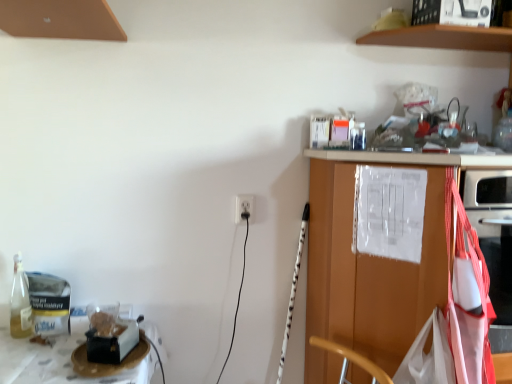
In order to face wooden cabinet at right, should I rotate leftwards or rightwards?

It's best to rotate right around 23.838 degrees.

This screenshot has width=512, height=384. Find the location of `white plastic electric outlet at center`. white plastic electric outlet at center is located at coordinates (245, 208).

This screenshot has height=384, width=512. Find the location of `countertop that is on the left side of brown wooden shelf at upper center`. countertop that is on the left side of brown wooden shelf at upper center is located at coordinates (374, 256).

Considering the positions of objects wooden cabinet at right and brown wooden shelf at upper center in the image provided, who is more to the left, wooden cabinet at right or brown wooden shelf at upper center?

Positioned to the left is wooden cabinet at right.

Based on the photo, is white plastic electric outlet at center turned away from wooden cabinet at right?

No, white plastic electric outlet at center is not facing the opposite direction of wooden cabinet at right.

Is the depth of white plastic electric outlet at center less than that of wooden cabinet at right?

No.

Find the location of a particular element. This screenshot has height=384, width=512. electric outlet that appears on the left of wooden cabinet at right is located at coordinates (245, 208).

Is brown wooden shelf at upper center located outside white plastic electric outlet at center?

Yes.

Could you tell me if brown wooden shelf at upper center is facing white plastic electric outlet at center?

No, brown wooden shelf at upper center is not aimed at white plastic electric outlet at center.

Is brown wooden shelf at upper center taller or shorter than white plastic electric outlet at center?

Clearly, brown wooden shelf at upper center is shorter compared to white plastic electric outlet at center.

Is brown wooden shelf at upper center turned away from wooden cabinet at right?

brown wooden shelf at upper center is not turned away from wooden cabinet at right.

Is brown wooden shelf at upper center directly adjacent to wooden cabinet at right?

No, brown wooden shelf at upper center is not in contact with wooden cabinet at right.

Is brown wooden shelf at upper center surrounding wooden cabinet at right?

No.

From a real-world perspective, is brown wooden shelf at upper center physically above wooden cabinet at right?

Yes.

Can you confirm if wooden cabinet at right is thinner than white plastic electric outlet at center?

No.

From the image's perspective, which is below, wooden cabinet at right or white plastic electric outlet at center?

wooden cabinet at right appears lower in the image.

From a real-world perspective, is wooden cabinet at right physically located above or below white plastic electric outlet at center?

wooden cabinet at right is below white plastic electric outlet at center.

Measure the distance between wooden cabinet at right and white plastic electric outlet at center.

wooden cabinet at right and white plastic electric outlet at center are 54.19 centimeters apart from each other.

Which is in front, point (238, 207) or point (460, 29)?

The point (460, 29) is closer.

Is white plastic electric outlet at center closer to the viewer compared to brown wooden shelf at upper center?

No.

Based on their sizes in the image, would you say white plastic electric outlet at center is bigger or smaller than brown wooden shelf at upper center?

Clearly, white plastic electric outlet at center is smaller in size than brown wooden shelf at upper center.

Does white plastic electric outlet at center contain brown wooden shelf at upper center?

Actually, brown wooden shelf at upper center is outside white plastic electric outlet at center.

You are a GUI agent. You are given a task and a screenshot of the screen. Output one action in this format:
    pyautogui.click(x=<x>, y=<y>)
    Task: Click on the shelf on the right side of wooden cabinet at right
    This screenshot has width=512, height=384.
    Given the screenshot: What is the action you would take?
    pyautogui.click(x=443, y=37)

This screenshot has width=512, height=384. I want to click on electric outlet behind the wooden cabinet at right, so click(245, 208).

From the image, which object appears to be nearer to white plastic electric outlet at center, brown wooden shelf at upper center or wooden cabinet at right?

wooden cabinet at right lies closer to white plastic electric outlet at center than the other object.

When comparing their distances from wooden cabinet at right, does brown wooden shelf at upper center or white plastic electric outlet at center seem closer?

white plastic electric outlet at center is closer to wooden cabinet at right.

Looking at the image, which one is located further to brown wooden shelf at upper center, wooden cabinet at right or white plastic electric outlet at center?

The object further to brown wooden shelf at upper center is white plastic electric outlet at center.

Estimate the real-world distances between objects in this image. Which object is closer to white plastic electric outlet at center, wooden cabinet at right or brown wooden shelf at upper center?

wooden cabinet at right lies closer to white plastic electric outlet at center than the other object.

From the image, which object appears to be nearer to wooden cabinet at right, white plastic electric outlet at center or brown wooden shelf at upper center?

Based on the image, white plastic electric outlet at center appears to be nearer to wooden cabinet at right.

Looking at the image, which one is located further to brown wooden shelf at upper center, white plastic electric outlet at center or wooden cabinet at right?

Based on the image, white plastic electric outlet at center appears to be further to brown wooden shelf at upper center.

The image size is (512, 384). Find the location of `electric outlet between brown wooden shelf at upper center and wooden cabinet at right in the vertical direction`. electric outlet between brown wooden shelf at upper center and wooden cabinet at right in the vertical direction is located at coordinates (245, 208).